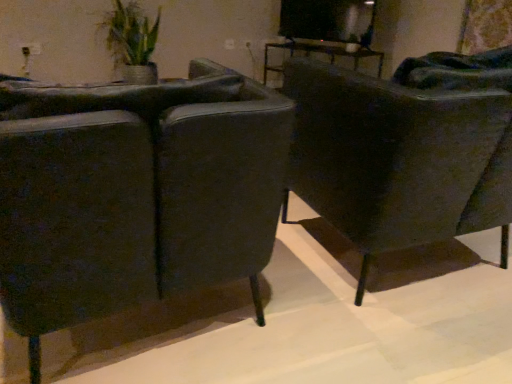
Question: From a real-world perspective, is green woven basket at upper left beneath matte black chair at left, the 1th chair viewed from the left?

Choices:
 (A) yes
 (B) no

Answer: (B)

Question: Is green woven basket at upper left closer to camera compared to matte black chair at left, the 1th chair viewed from the left?

Choices:
 (A) yes
 (B) no

Answer: (B)

Question: Considering the relative positions of green woven basket at upper left and matte black chair at left, the 1th chair viewed from the left, in the image provided, is green woven basket at upper left to the right of matte black chair at left, the 1th chair viewed from the left, from the viewer's perspective?

Choices:
 (A) no
 (B) yes

Answer: (A)

Question: Is green woven basket at upper left shorter than matte black chair at left, the 1th chair viewed from the left?

Choices:
 (A) yes
 (B) no

Answer: (A)

Question: From the image's perspective, is green woven basket at upper left on matte black chair at left, which is counted as the second chair, starting from the right?

Choices:
 (A) no
 (B) yes

Answer: (B)

Question: Based on their positions, is green woven basket at upper left located to the left or right of matte black chair at left, which is counted as the second chair, starting from the right?

Choices:
 (A) left
 (B) right

Answer: (A)

Question: Is green woven basket at upper left bigger or smaller than matte black chair at left, which is counted as the second chair, starting from the right?

Choices:
 (A) big
 (B) small

Answer: (B)

Question: Is green woven basket at upper left inside or outside of matte black chair at left, the 1th chair viewed from the left?

Choices:
 (A) inside
 (B) outside

Answer: (B)

Question: From their relative heights in the image, would you say green woven basket at upper left is taller or shorter than matte black chair at left, the 1th chair viewed from the left?

Choices:
 (A) short
 (B) tall

Answer: (A)

Question: Would you say matte black chair at right, the 1th chair when ordered from right to left, is inside or outside matte black chair at left, the 1th chair viewed from the left?

Choices:
 (A) inside
 (B) outside

Answer: (B)

Question: In terms of width, does matte black chair at right, the second chair in the left-to-right sequence, look wider or thinner when compared to matte black chair at left, which is counted as the second chair, starting from the right?

Choices:
 (A) thin
 (B) wide

Answer: (B)

Question: In terms of height, does matte black chair at right, the 1th chair when ordered from right to left, look taller or shorter compared to matte black chair at left, the 1th chair viewed from the left?

Choices:
 (A) tall
 (B) short

Answer: (B)

Question: In the image, is matte black chair at right, the second chair in the left-to-right sequence, on the left side or the right side of matte black chair at left, which is counted as the second chair, starting from the right?

Choices:
 (A) right
 (B) left

Answer: (A)

Question: Is green woven basket at upper left taller or shorter than matte black chair at right, the 1th chair when ordered from right to left?

Choices:
 (A) tall
 (B) short

Answer: (B)

Question: Is green woven basket at upper left wider or thinner than matte black chair at right, the 1th chair when ordered from right to left?

Choices:
 (A) wide
 (B) thin

Answer: (B)